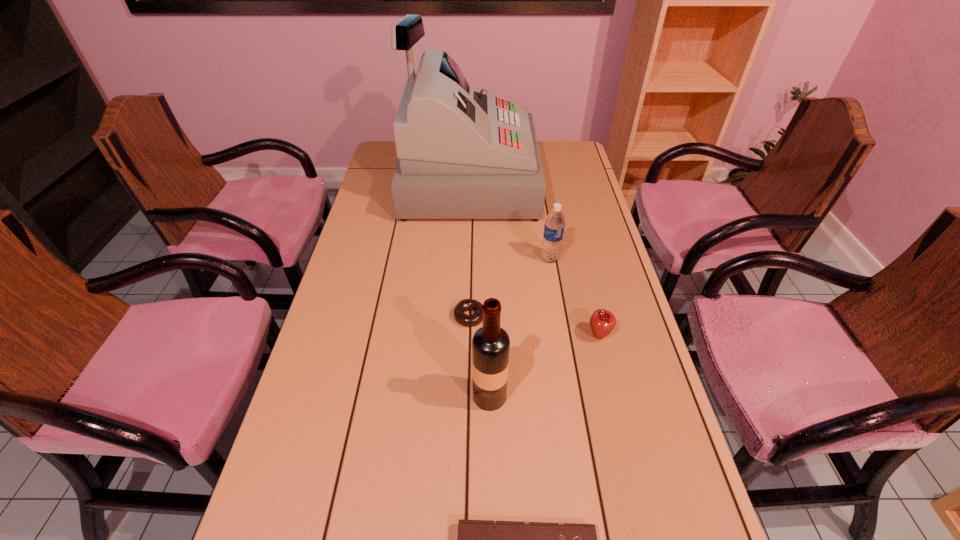
At what (x,y) coordinates should I click in order to perform the action: click on vacant area that lies between the rightmost object and the doughnut. Please return your answer as a coordinate pair (x, y). This screenshot has height=540, width=960. Looking at the image, I should click on (535, 326).

Identify the location of vacant space that is in between the third shortest object and the cash register. (534, 258).

You are a GUI agent. You are given a task and a screenshot of the screen. Output one action in this format:
    pyautogui.click(x=<x>, y=<y>)
    Task: Click on the free space between the fifth farthest object and the rightmost object
    The image size is (960, 540).
    Given the screenshot: What is the action you would take?
    pyautogui.click(x=544, y=366)

Where is `vacant area that lies between the tallest object and the fifth farthest object`? The image size is (960, 540). vacant area that lies between the tallest object and the fifth farthest object is located at coordinates (478, 288).

I want to click on unoccupied position between the fifth shortest object and the fifth nearest object, so click(x=519, y=327).

Identify which object is located as the third nearest to the nearest object. Please provide its 2D coordinates. Your answer should be formatted as a tuple, i.e. [(x, y)], where the tuple contains the x and y coordinates of a point satisfying the conditions above.

[(476, 318)]

Find the location of a particular element. object identified as the second closest to the tallest object is located at coordinates (476, 318).

The width and height of the screenshot is (960, 540). I want to click on free spot that satisfies the following two spatial constraints: 1. on the back side of the wine bottle; 2. on the left side of the fifth nearest object, so click(x=487, y=259).

The width and height of the screenshot is (960, 540). I want to click on vacant space that satisfies the following two spatial constraints: 1. on the keypad side of the tallest object; 2. on the right side of the fifth shortest object, so click(x=459, y=396).

Where is `blank area in the image that satisfies the following two spatial constraints: 1. on the keypad side of the apple; 2. on the right side of the tallest object`? Image resolution: width=960 pixels, height=540 pixels. blank area in the image that satisfies the following two spatial constraints: 1. on the keypad side of the apple; 2. on the right side of the tallest object is located at coordinates (462, 335).